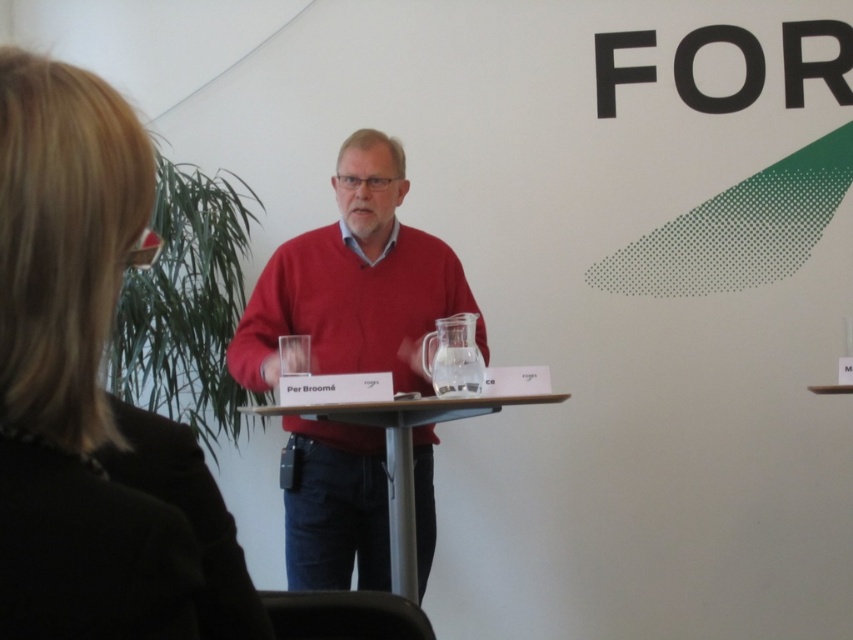
Question: Which object is closer to the camera taking this photo?

Choices:
 (A) wooden table at center
 (B) matte red sweater at center
 (C) black fabric hair at upper left

Answer: (C)

Question: Among these points, which one is nearest to the camera?

Choices:
 (A) (357, 420)
 (B) (80, 614)
 (C) (415, 513)

Answer: (B)

Question: Considering the relative positions of matte red sweater at center and wooden table at center in the image provided, where is matte red sweater at center located with respect to wooden table at center?

Choices:
 (A) right
 (B) left

Answer: (B)

Question: Considering the real-world distances, which object is closest to the wooden table at center?

Choices:
 (A) matte red sweater at center
 (B) black fabric hair at upper left

Answer: (A)

Question: Can you confirm if black fabric hair at upper left is bigger than matte red sweater at center?

Choices:
 (A) yes
 (B) no

Answer: (B)

Question: Can you confirm if black fabric hair at upper left is positioned above matte red sweater at center?

Choices:
 (A) yes
 (B) no

Answer: (A)